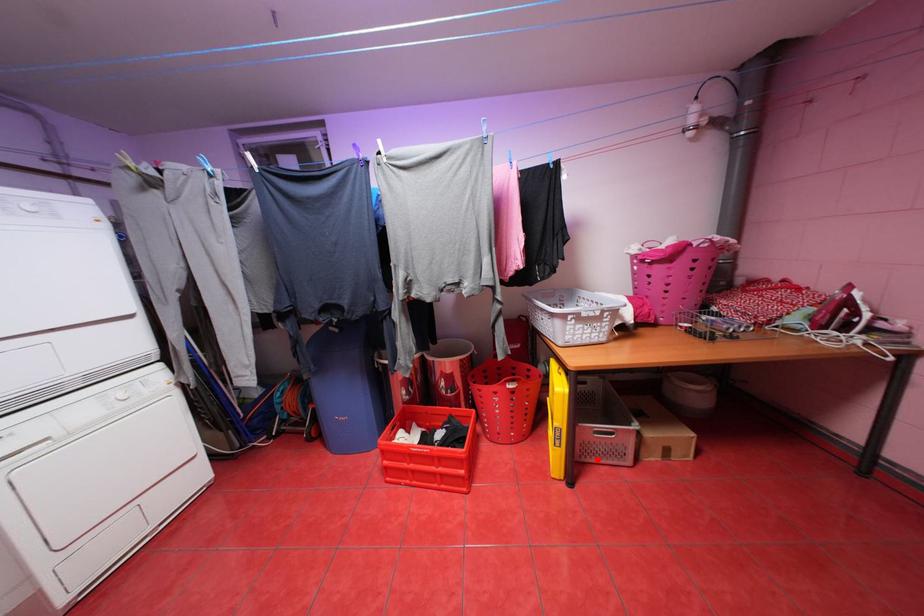
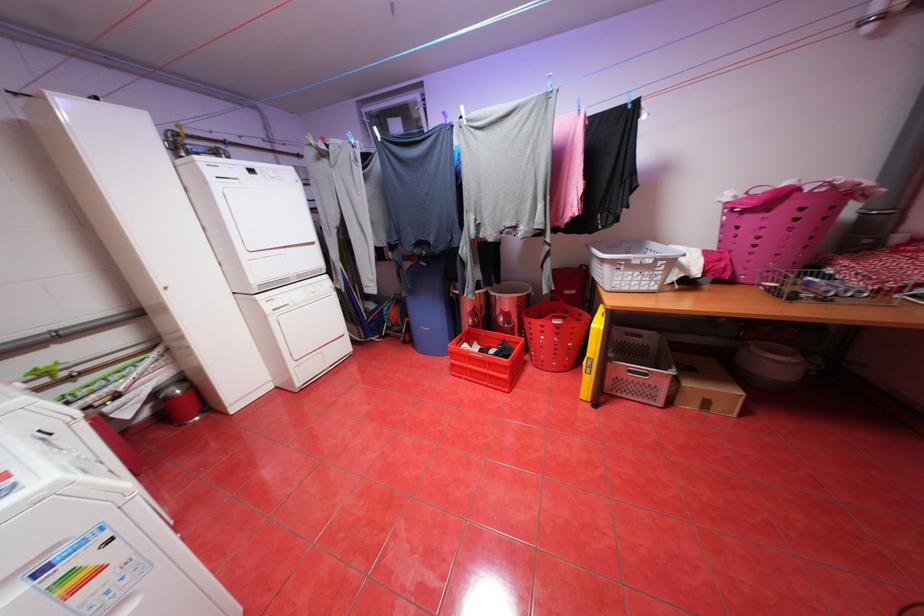
Question: I am providing you with two images of the same scene from different viewpoints. A red point is shown in image1. For the corresponding object point in image2, is it positioned nearer or farther from the camera?

Choices:
 (A) Nearer
 (B) Farther

Answer: (A)